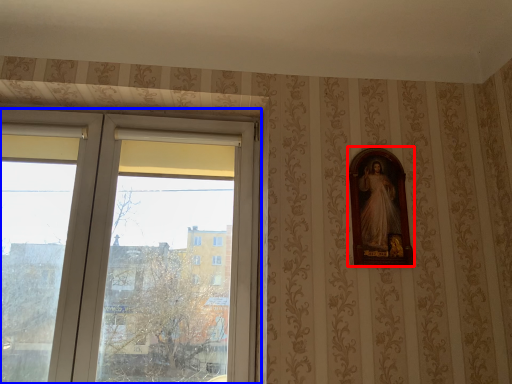
Question: Which object appears closest to the camera in this image, picture frame (highlighted by a red box) or window (highlighted by a blue box)?

Choices:
 (A) picture frame
 (B) window

Answer: (B)